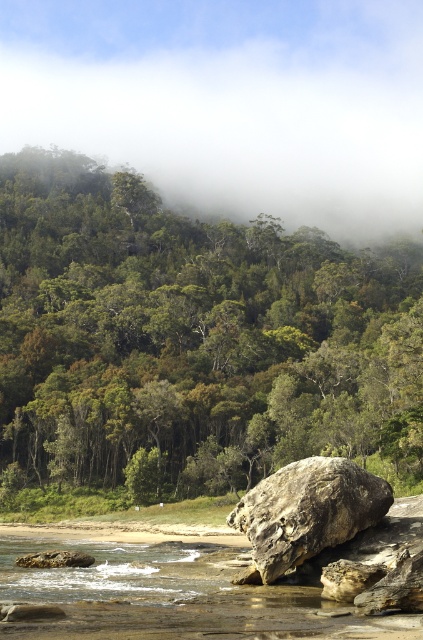
Based on the photo, is green leafy tree at center in front of rusty stone boulder at center?

No, it is not.

Does green leafy tree at center have a lesser width compared to rusty stone boulder at center?

In fact, green leafy tree at center might be wider than rusty stone boulder at center.

Does point (165, 474) come behind point (268, 556)?

Yes, it is.

Locate an element on the screen. Image resolution: width=423 pixels, height=640 pixels. green leafy tree at center is located at coordinates (192, 339).

Which is more to the left, green leafy tree at center or foggy misty forest at upper center?

foggy misty forest at upper center

Does point (151, 269) come in front of point (154, 86)?

Yes, point (151, 269) is in front of point (154, 86).

Is point (315, 352) farther from viewer compared to point (395, 45)?

No, it is not.

This screenshot has height=640, width=423. I want to click on green leafy tree at center, so click(x=192, y=339).

Which is behind, point (299, 120) or point (346, 538)?

The point (299, 120) is more distant.

From the picture: Can you confirm if foggy misty forest at upper center is wider than rusty stone boulder at center?

Yes, foggy misty forest at upper center is wider than rusty stone boulder at center.

The image size is (423, 640). What do you see at coordinates (230, 102) in the screenshot?
I see `foggy misty forest at upper center` at bounding box center [230, 102].

Identify the location of foggy misty forest at upper center. This screenshot has width=423, height=640. (230, 102).